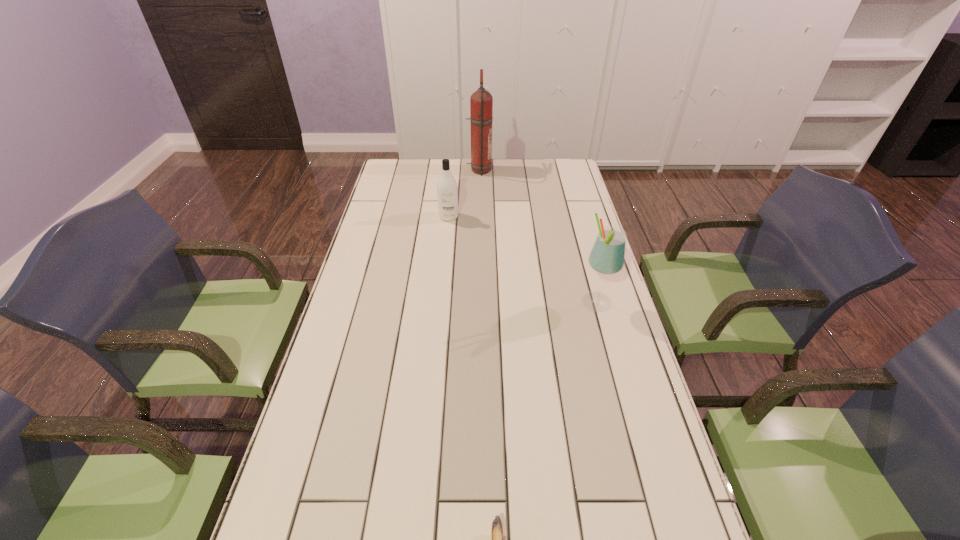
Where is `object that is the closest to the fire extinguisher`? object that is the closest to the fire extinguisher is located at coordinates (447, 192).

This screenshot has width=960, height=540. I want to click on free space that satisfies the following two spatial constraints: 1. on the side of the tallest object with the label and nozzle; 2. on the back side of the third farthest object, so click(x=479, y=303).

Identify the location of free location that satisfies the following two spatial constraints: 1. on the front-facing side of the second shortest object; 2. on the right side of the alcohol. The image size is (960, 540). (441, 303).

Identify the location of vacant space that satisfies the following two spatial constraints: 1. on the side of the farthest object with the label and nozzle; 2. on the left side of the alcohol. (479, 303).

Locate an element on the screen. free point that satisfies the following two spatial constraints: 1. on the side of the fire extinguisher with the label and nozzle; 2. on the right side of the rightmost object is located at coordinates (479, 303).

At what (x,y) coordinates should I click in order to perform the action: click on free space that satisfies the following two spatial constraints: 1. on the front-facing side of the third farthest object; 2. on the left side of the third nearest object. Please return your answer as a coordinate pair (x, y). Image resolution: width=960 pixels, height=540 pixels. Looking at the image, I should click on (441, 303).

I want to click on free space that satisfies the following two spatial constraints: 1. on the side of the farthest object with the label and nozzle; 2. on the front-facing side of the second farthest object, so click(x=479, y=217).